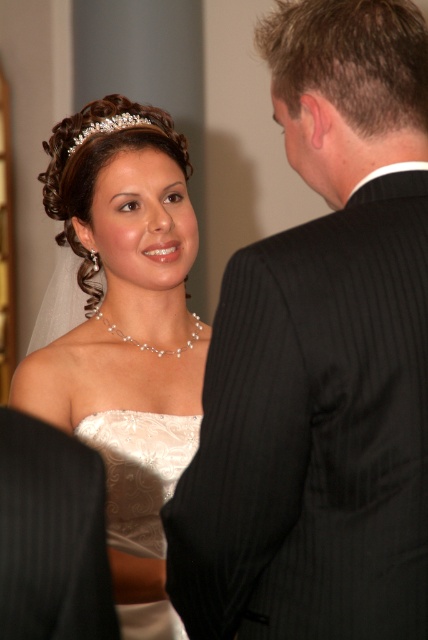
Can you confirm if white satin dress at center is wider than white lace dress at center?

Correct, the width of white satin dress at center exceeds that of white lace dress at center.

Is point (177, 184) farther from viewer compared to point (169, 486)?

Yes, point (177, 184) is behind point (169, 486).

What are the coordinates of `white satin dress at center` in the screenshot? It's located at (125, 337).

Which of these two, black pinstripe suit at right or white lace dress at center, stands shorter?

white lace dress at center

Does black pinstripe suit at right have a larger size compared to white lace dress at center?

Yes, black pinstripe suit at right is bigger than white lace dress at center.

The height and width of the screenshot is (640, 428). What do you see at coordinates (321, 358) in the screenshot? I see `black pinstripe suit at right` at bounding box center [321, 358].

In order to click on black pinstripe suit at right in this screenshot , I will do `click(321, 358)`.

Is white satin dress at center below clear crystal tiara at upper center?

Correct, white satin dress at center is located below clear crystal tiara at upper center.

Who is more forward, (101, 150) or (118, 115)?

Point (101, 150) is more forward.

Which is in front, point (125, 381) or point (116, 120)?

Point (125, 381) is more forward.

The height and width of the screenshot is (640, 428). In order to click on white satin dress at center in this screenshot , I will do `click(125, 337)`.